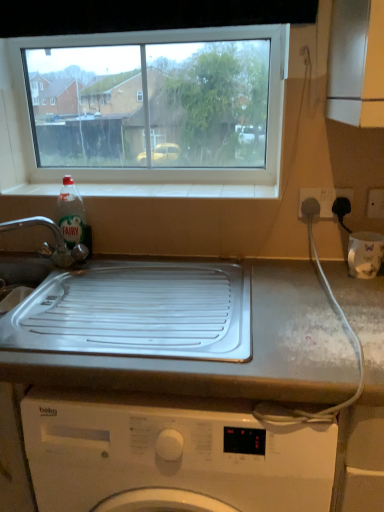
You are a GUI agent. You are given a task and a screenshot of the screen. Output one action in this format:
    pyautogui.click(x=<x>, y=<y>)
    Task: Click on the brushed metal tap at left
    The height and width of the screenshot is (512, 384).
    Given the screenshot: What is the action you would take?
    pyautogui.click(x=55, y=241)

What do you see at coordinates (154, 111) in the screenshot? The height and width of the screenshot is (512, 384). I see `transparent glass window at upper center` at bounding box center [154, 111].

What is the approximate height of transparent glass window at upper center?

transparent glass window at upper center is 18.89 inches tall.

You are a GUI agent. You are given a task and a screenshot of the screen. Output one action in this format:
    pyautogui.click(x=<x>, y=<y>)
    Task: Click on the white glossy countertop at center
    The width and height of the screenshot is (384, 512).
    Given the screenshot: What is the action you would take?
    pyautogui.click(x=230, y=362)

The width and height of the screenshot is (384, 512). What do you see at coordinates (179, 190) in the screenshot? I see `white tile at upper center` at bounding box center [179, 190].

Find the location of a particular element. white plastic electric outlet at right, which is counted as the first electric outlet, starting from the right is located at coordinates pyautogui.click(x=375, y=203).

Could you tell me if white tile at upper center is facing brushed metal tap at left?

No, white tile at upper center is not aimed at brushed metal tap at left.

Is white tile at upper center positioned beyond the bounds of brushed metal tap at left?

That's correct, white tile at upper center is outside of brushed metal tap at left.

From a real-world perspective, which object stands above the other?

In real-world perspective, white tile at upper center is above.

Considering the positions of points (239, 188) and (30, 226), is point (239, 188) closer to camera compared to point (30, 226)?

Yes, point (239, 188) is in front of point (30, 226).

Does point (95, 194) lie in front of point (64, 185)?

Yes, point (95, 194) is closer to viewer.

In the image, is white tile at upper center positioned in front of or behind clear plastic bottle at sink left?

white tile at upper center is positioned farther from the viewer than clear plastic bottle at sink left.

Would you say white tile at upper center contains clear plastic bottle at sink left?

Actually, clear plastic bottle at sink left is outside white tile at upper center.

Is white tile at upper center oriented towards clear plastic bottle at sink left?

No, white tile at upper center is not oriented towards clear plastic bottle at sink left.

Are white plastic electric outlet at right, positioned as the 2th electric outlet in left-to-right order, and transparent glass window at upper center making contact?

white plastic electric outlet at right, positioned as the 2th electric outlet in left-to-right order, is not next to transparent glass window at upper center, and they're not touching.

How far apart are white plastic electric outlet at right, which is counted as the first electric outlet, starting from the right, and transparent glass window at upper center?

The distance of white plastic electric outlet at right, which is counted as the first electric outlet, starting from the right, from transparent glass window at upper center is 3.81 feet.

From the image's perspective, between white plastic electric outlet at right, positioned as the 2th electric outlet in left-to-right order, and transparent glass window at upper center, which one is located above?

From the image's view, transparent glass window at upper center is above.

Which object is further away from the camera, white plastic electric outlet at right, positioned as the 2th electric outlet in left-to-right order, or transparent glass window at upper center?

transparent glass window at upper center is further away from the camera.

Are brushed metal tap at left and clear plastic bottle at sink left making contact?

Yes, brushed metal tap at left and clear plastic bottle at sink left clearly make contact.

This screenshot has height=512, width=384. Find the location of `bottle located above the brushed metal tap at left (from the image's perspective)`. bottle located above the brushed metal tap at left (from the image's perspective) is located at coordinates (72, 215).

From a real-world perspective, is brushed metal tap at left positioned above or below clear plastic bottle at sink left?

In terms of real-world spatial position, brushed metal tap at left is below clear plastic bottle at sink left.

Between brushed metal tap at left and clear plastic bottle at sink left, which one appears on the left side from the viewer's perspective?

Positioned to the left is brushed metal tap at left.

Which object is further away from the camera taking this photo, clear plastic bottle at sink left or white plastic electric outlet at right, positioned as the 2th electric outlet in left-to-right order?

clear plastic bottle at sink left is further away from the camera.

Considering the sizes of objects clear plastic bottle at sink left and white plastic electric outlet at right, which is counted as the first electric outlet, starting from the right, in the image provided, who is thinner, clear plastic bottle at sink left or white plastic electric outlet at right, which is counted as the first electric outlet, starting from the right,?

white plastic electric outlet at right, which is counted as the first electric outlet, starting from the right, is thinner.

Is point (77, 199) positioned in front of point (367, 203)?

No.

Can you tell me how much clear plastic bottle at sink left and white plastic electric outlet at right, which is counted as the first electric outlet, starting from the right, differ in facing direction?

clear plastic bottle at sink left and white plastic electric outlet at right, which is counted as the first electric outlet, starting from the right, are facing 0.976 degrees away from each other.

At what (x,y) coordinates should I click in order to perform the action: click on bottle below the white plastic socket at upper right, which is counted as the first electric outlet, starting from the left (from a real-world perspective). Please return your answer as a coordinate pair (x, y). The width and height of the screenshot is (384, 512). Looking at the image, I should click on point(72,215).

From the image's perspective, relative to clear plastic bottle at sink left, is white plastic socket at upper right, marked as the second electric outlet in a right-to-left arrangement, above or below?

From the image's perspective, white plastic socket at upper right, marked as the second electric outlet in a right-to-left arrangement, appears above clear plastic bottle at sink left.

Does point (299, 200) appear closer or farther from the camera than point (79, 217)?

Point (299, 200) is closer to the camera than point (79, 217).

Looking at this image, from the image's perspective, is transparent glass window at upper center above brushed metal tap at left?

Yes, from the image's perspective, transparent glass window at upper center is over brushed metal tap at left.

Is transparent glass window at upper center further to the viewer compared to brushed metal tap at left?

Yes, transparent glass window at upper center is further from the viewer.

Considering the sizes of transparent glass window at upper center and brushed metal tap at left in the image, is transparent glass window at upper center wider or thinner than brushed metal tap at left?

Considering their sizes, transparent glass window at upper center looks slimmer than brushed metal tap at left.

The image size is (384, 512). In order to click on window sill above the brushed metal tap at left (from a real-world perspective) in this screenshot , I will do `click(179, 190)`.

This screenshot has height=512, width=384. Identify the location of bottle to the left of white tile at upper center. (72, 215).

Considering their positions, is white plastic socket at upper right, which is counted as the first electric outlet, starting from the left, positioned closer to transparent glass window at upper center than clear plastic bottle at sink left?

Based on the image, clear plastic bottle at sink left appears to be nearer to transparent glass window at upper center.

From the image, which object appears to be nearer to white glossy countertop at center, transparent glass window at upper center or white tile at upper center?

white tile at upper center is positioned closer to the anchor white glossy countertop at center.

From the image, which object appears to be nearer to white glossy countertop at center, clear plastic bottle at sink left or white plastic socket at upper right, marked as the second electric outlet in a right-to-left arrangement?

Based on the image, white plastic socket at upper right, marked as the second electric outlet in a right-to-left arrangement, appears to be nearer to white glossy countertop at center.

Estimate the real-world distances between objects in this image. Which object is closer to white tile at upper center, brushed metal tap at left or white plastic socket at upper right, marked as the second electric outlet in a right-to-left arrangement?

The object closer to white tile at upper center is brushed metal tap at left.

Based on their spatial positions, is white glossy countertop at center or transparent glass window at upper center closer to brushed metal tap at left?

Based on the image, white glossy countertop at center appears to be nearer to brushed metal tap at left.

Considering their positions, is white tile at upper center positioned closer to transparent glass window at upper center than white glossy countertop at center?

white tile at upper center lies closer to transparent glass window at upper center than the other object.

Estimate the real-world distances between objects in this image. Which object is closer to white tile at upper center, white plastic socket at upper right, marked as the second electric outlet in a right-to-left arrangement, or white glossy countertop at center?

The object closer to white tile at upper center is white plastic socket at upper right, marked as the second electric outlet in a right-to-left arrangement.

Estimate the real-world distances between objects in this image. Which object is closer to transparent glass window at upper center, white plastic electric outlet at right, positioned as the 2th electric outlet in left-to-right order, or clear plastic bottle at sink left?

clear plastic bottle at sink left.

The width and height of the screenshot is (384, 512). Identify the location of bottle between white plastic socket at upper right, which is counted as the first electric outlet, starting from the left, and white glossy countertop at center, in the vertical direction. (72, 215).

Where is `bottle located between brushed metal tap at left and white plastic electric outlet at right, which is counted as the first electric outlet, starting from the right, in the left-right direction`? This screenshot has height=512, width=384. bottle located between brushed metal tap at left and white plastic electric outlet at right, which is counted as the first electric outlet, starting from the right, in the left-right direction is located at coordinates (72, 215).

Image resolution: width=384 pixels, height=512 pixels. I want to click on tap between transparent glass window at upper center and white glossy countertop at center from top to bottom, so click(x=55, y=241).

Where is `bottle between transparent glass window at upper center and white glossy countertop at center in the vertical direction`? bottle between transparent glass window at upper center and white glossy countertop at center in the vertical direction is located at coordinates (72, 215).